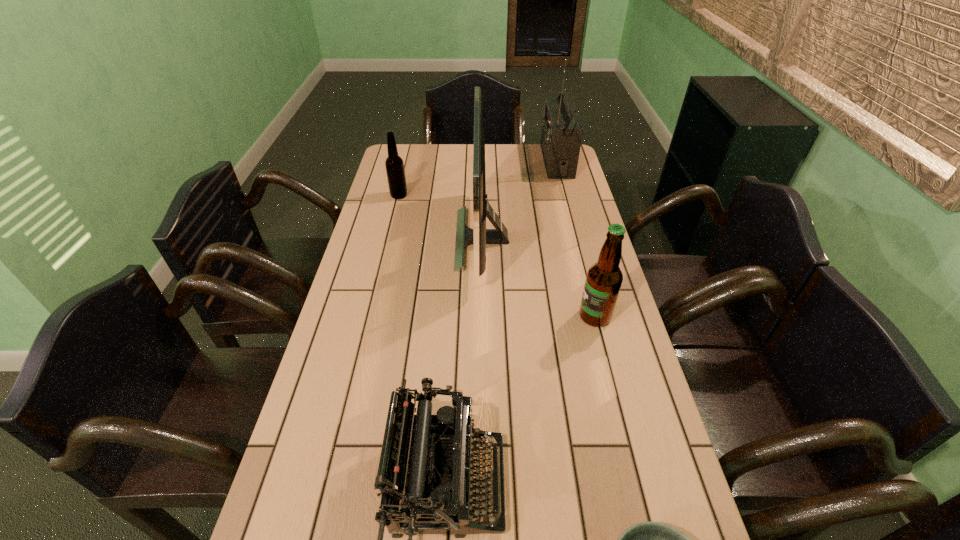
At what (x,y) coordinates should I click in order to perform the action: click on radio receiver. Please return your answer as a coordinate pair (x, y). This screenshot has height=540, width=960. Looking at the image, I should click on (561, 136).

Identify the location of monitor. point(479,236).

Where is `the third tallest object`? The width and height of the screenshot is (960, 540). the third tallest object is located at coordinates (604, 278).

Locate an element on the screen. This screenshot has height=540, width=960. the nearer beer bottle is located at coordinates (604, 278).

Where is `the fourth tallest object`? The width and height of the screenshot is (960, 540). the fourth tallest object is located at coordinates (394, 164).

At what (x,y) coordinates should I click in order to perform the action: click on the leftmost object. Please return your answer as a coordinate pair (x, y). The image size is (960, 540). Looking at the image, I should click on (394, 164).

I want to click on vacant point located on the front panel of the farthest object, so click(494, 161).

The image size is (960, 540). In order to click on free space located on the front panel of the farthest object in this screenshot , I will do `click(461, 161)`.

Where is `vacant space situated on the front panel of the farthest object`? The height and width of the screenshot is (540, 960). vacant space situated on the front panel of the farthest object is located at coordinates (456, 161).

Image resolution: width=960 pixels, height=540 pixels. Find the location of `vacant region located on the screen side of the monitor`. vacant region located on the screen side of the monitor is located at coordinates (433, 239).